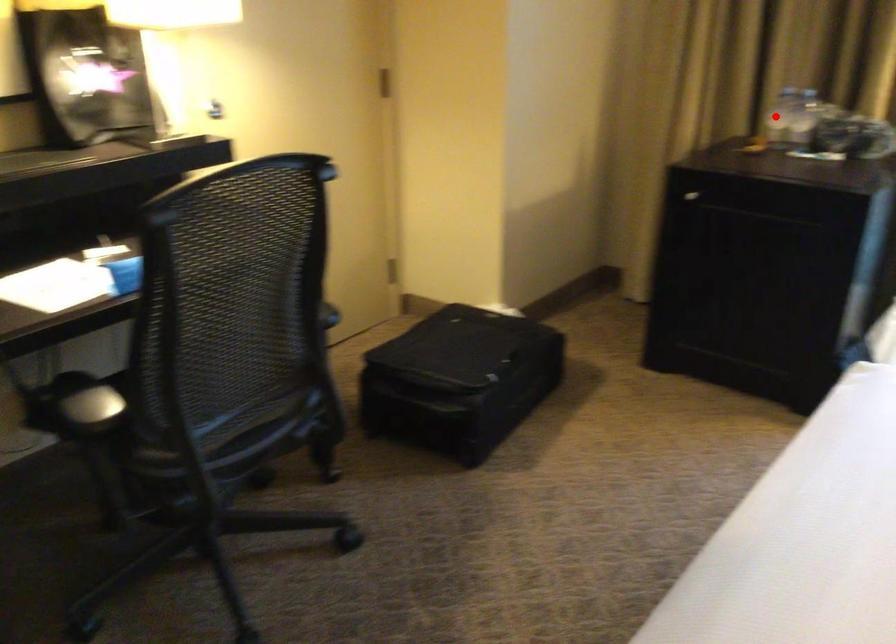
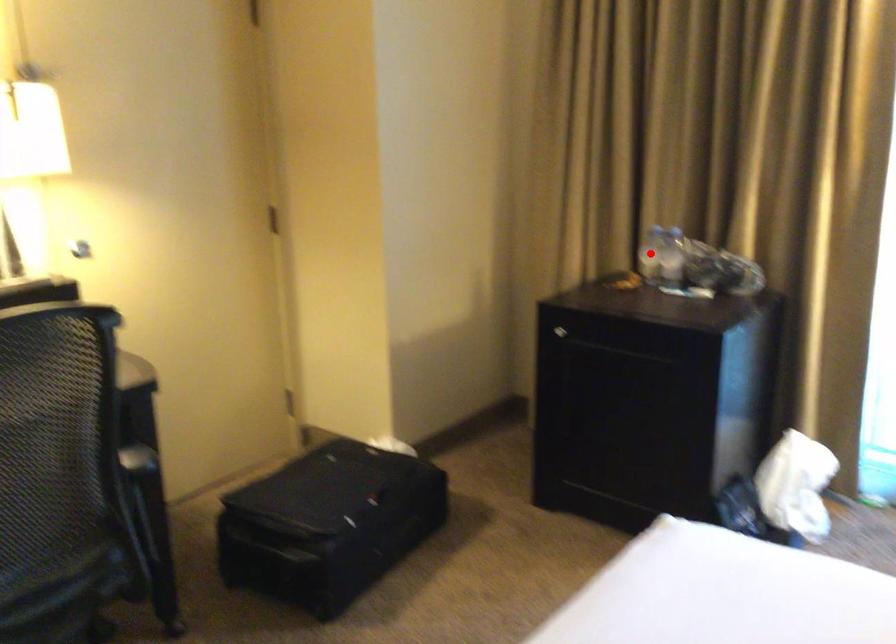
I am providing you with two images of the same scene from different viewpoints. A red point is marked on the first image and another point is marked on the second image. Is the red point in image1 aligned with the point shown in image2?

Yes